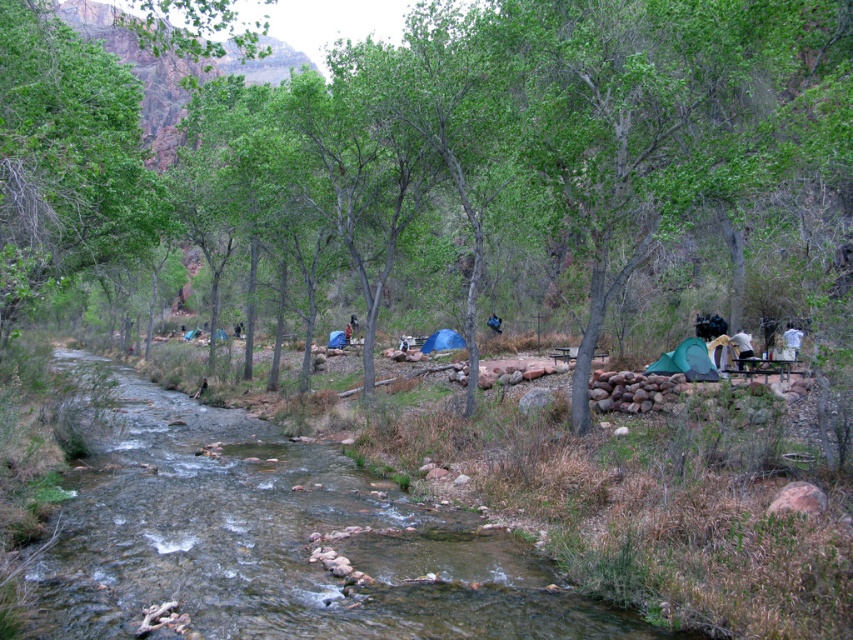
From the picture: What are the coordinates of the clear water stream at center?

The clear water stream at center is located at coordinates point (280, 541).

You are planning to set up a tent near the clear water stream at center. Based on the coordinates provided, can you determine if the stream is located towards the left or right side of the image?

The clear water stream at center is located at coordinates point (x=280, y=541), which places it towards the right side of the image.

What are the coordinates of the green fabric tent at lower right in the image?

The green fabric tent at lower right is located at coordinates point (686,362).